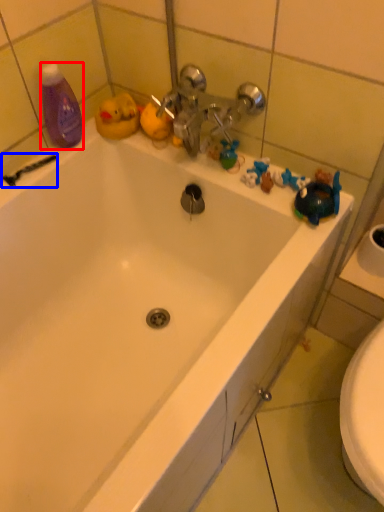
Question: Which object appears farthest to the camera in this image, cleaning product (highlighted by a red box) or shower (highlighted by a blue box)?

Choices:
 (A) cleaning product
 (B) shower

Answer: (B)